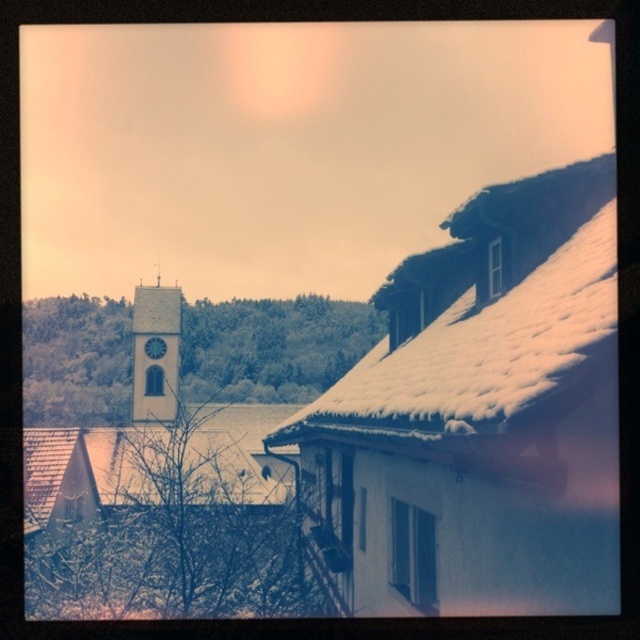
Question: Is the position of white snow-covered roof at upper right less distant than that of blue glossy clock at center?

Choices:
 (A) yes
 (B) no

Answer: (A)

Question: Which object is positioned farthest from the blue glossy clock at center?

Choices:
 (A) white stone clock tower at center
 (B) white snow-covered roof at upper right

Answer: (B)

Question: Among these objects, which one is farthest from the camera?

Choices:
 (A) white snow-covered roof at upper right
 (B) blue glossy clock at center

Answer: (B)

Question: Is white snow-covered roof at upper right below blue glossy clock at center?

Choices:
 (A) yes
 (B) no

Answer: (B)

Question: Which point appears farthest from the camera in this image?

Choices:
 (A) (150, 342)
 (B) (173, 307)

Answer: (B)

Question: Where is white snow-covered roof at upper right located in relation to white stone clock tower at center in the image?

Choices:
 (A) left
 (B) right

Answer: (B)